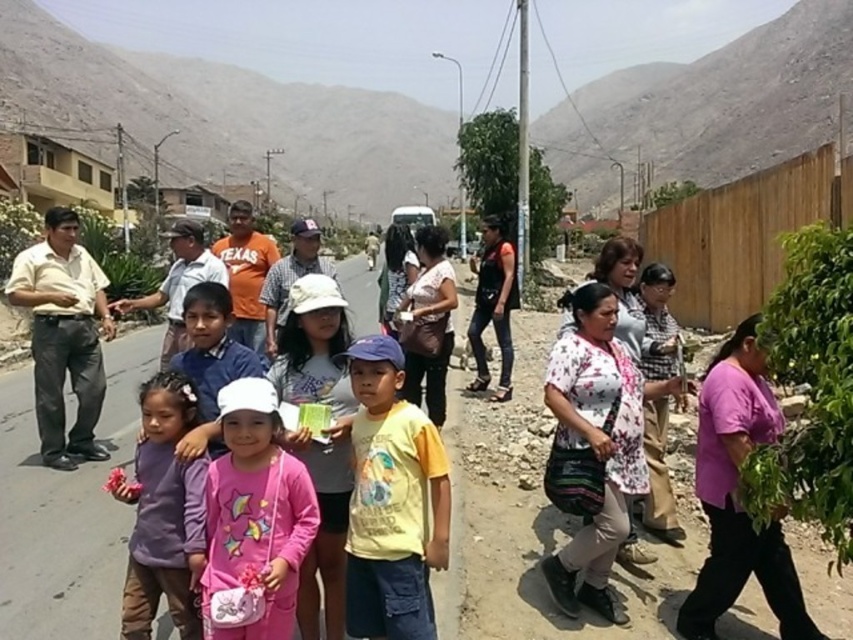
Looking at this image, can you confirm if yellow cotton shirt at center is thinner than pink fabric purse at center?

No.

Is yellow cotton shirt at center shorter than pink fabric purse at center?

In fact, yellow cotton shirt at center may be taller than pink fabric purse at center.

What do you see at coordinates (392, 500) in the screenshot? I see `yellow cotton shirt at center` at bounding box center [392, 500].

This screenshot has height=640, width=853. Find the location of `yellow cotton shirt at center`. yellow cotton shirt at center is located at coordinates (392, 500).

Between point (358, 353) and point (128, 604), which one is positioned in front?

Point (358, 353) is in front.

Locate an element on the screen. The image size is (853, 640). yellow cotton shirt at center is located at coordinates (392, 500).

Is pink fabric purse at center above purple fleece jacket at lower left?

Yes, pink fabric purse at center is above purple fleece jacket at lower left.

Is pink fabric purse at center taller than purple fleece jacket at lower left?

In fact, pink fabric purse at center may be shorter than purple fleece jacket at lower left.

Is point (262, 570) farther from camera compared to point (165, 445)?

That is False.

Where is `pink fabric purse at center`? pink fabric purse at center is located at coordinates (254, 520).